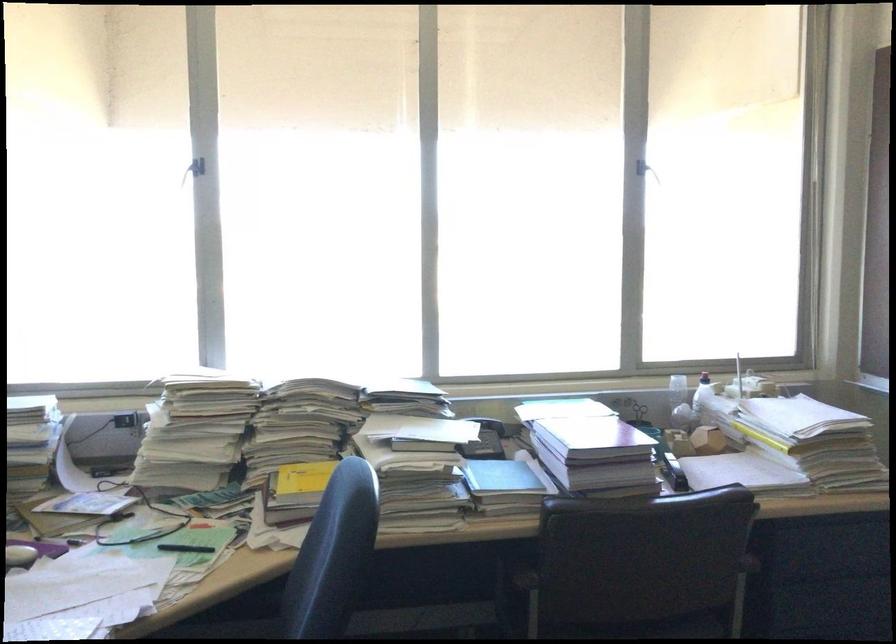
The image size is (896, 644). Describe the element at coordinates (225, 629) in the screenshot. I see `the chair sitting surface` at that location.